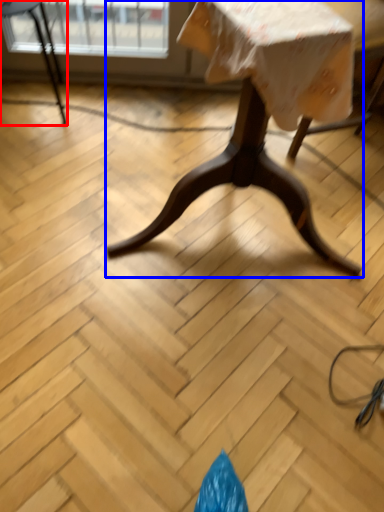
Question: Which of the following is the farthest to the observer, chair (highlighted by a red box) or table (highlighted by a blue box)?

Choices:
 (A) chair
 (B) table

Answer: (A)